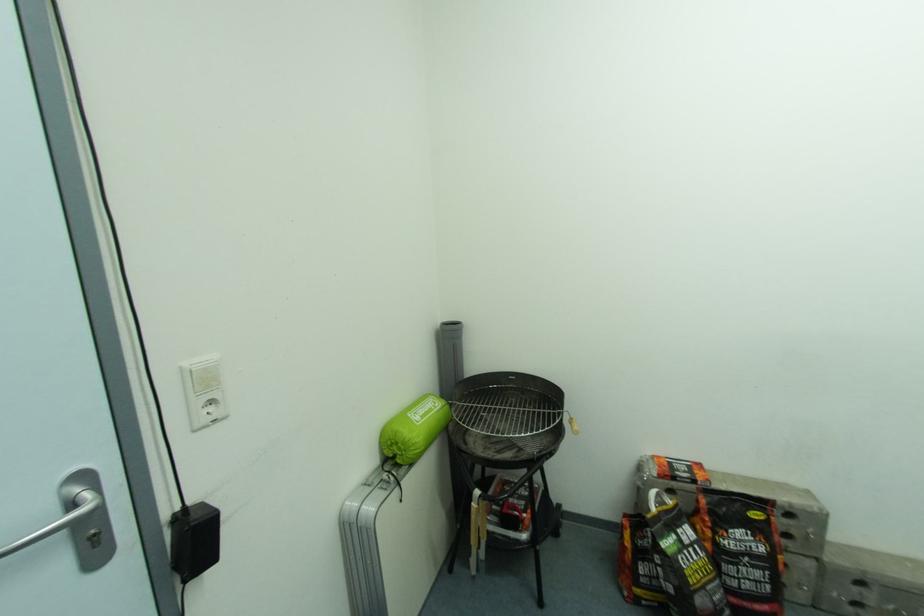
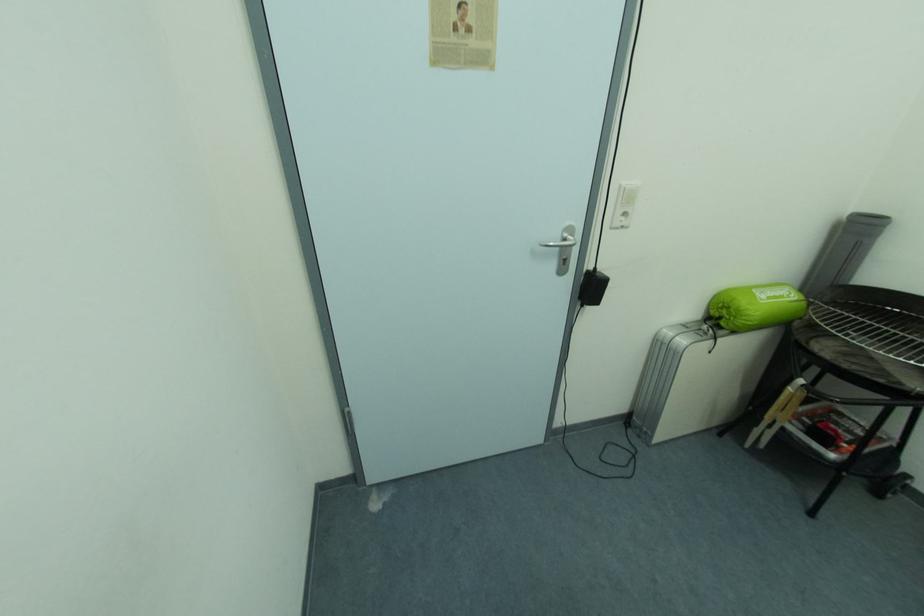
First-person continuous shooting, in which direction is the camera rotating?

The camera rotated toward left-down.